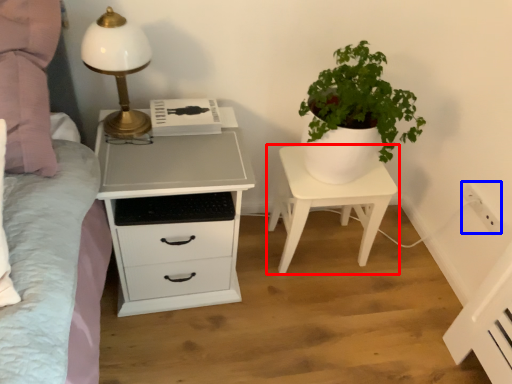
Question: Which object is closer to the camera taking this photo, nightstand (highlighted by a red box) or electric outlet (highlighted by a blue box)?

Choices:
 (A) nightstand
 (B) electric outlet

Answer: (A)